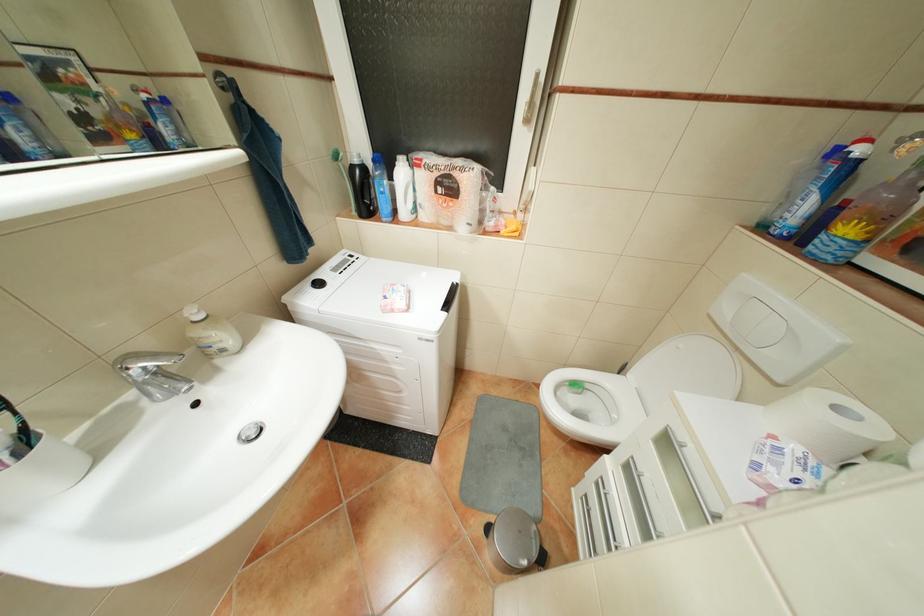
Image resolution: width=924 pixels, height=616 pixels. I want to click on toilet lid, so pyautogui.click(x=686, y=370).